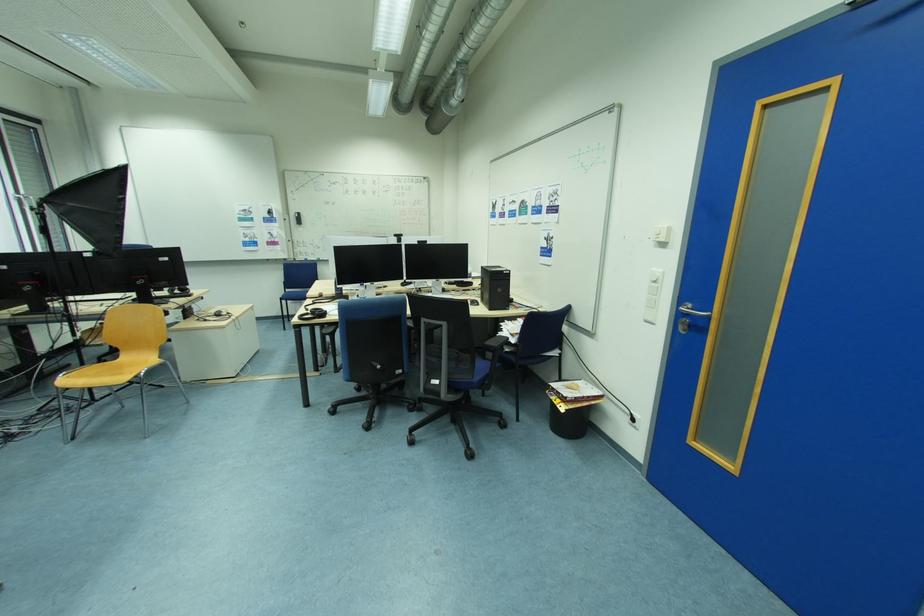
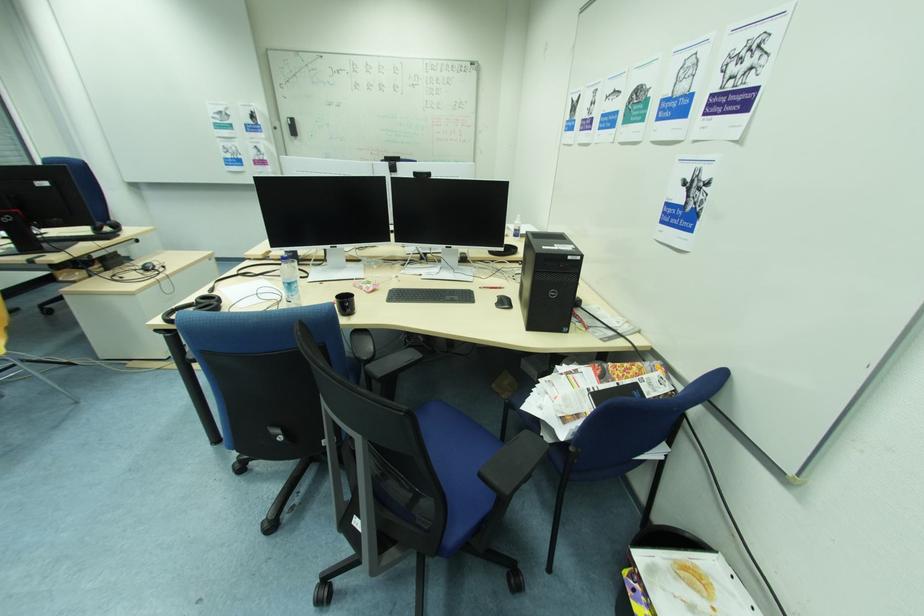
The point at [296,216] is marked in the first image. Where is the corresponding point in the second image?

(286, 122)